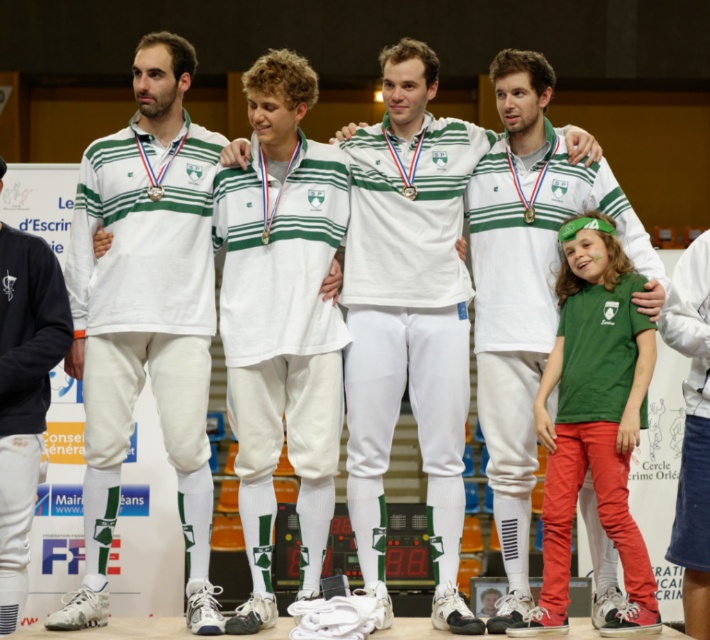
Question: Which object is closer to the camera taking this photo?

Choices:
 (A) white smooth uniform at center
 (B) white matte uniform at center
 (C) white fabric pants at left
 (D) matte white uniform at center

Answer: (A)

Question: Is green jersey at right further to the viewer compared to white cotton shirt at center?

Choices:
 (A) no
 (B) yes

Answer: (A)

Question: Is matte white uniform at center in front of white matte uniform at center?

Choices:
 (A) yes
 (B) no

Answer: (B)

Question: Among these objects, which one is nearest to the camera?

Choices:
 (A) matte white uniform at center
 (B) white cotton shirt at center
 (C) green jersey at right

Answer: (C)

Question: Which is nearer to the white smooth uniform at center?

Choices:
 (A) white matte uniform at center
 (B) white cotton shirt at center
 (C) white fabric pants at left

Answer: (A)

Question: Observing the image, what is the correct spatial positioning of matte white uniform at center in reference to white cotton shirt at center?

Choices:
 (A) below
 (B) above

Answer: (B)